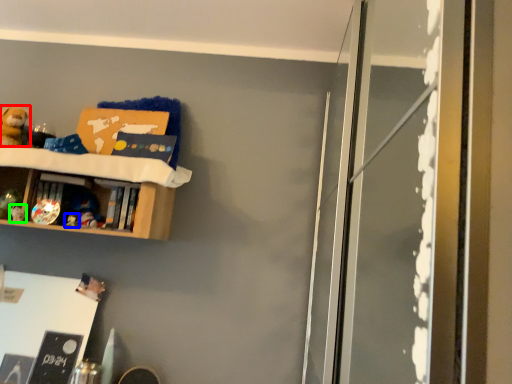
Question: Which object is the farthest from toy (highlighted by a red box)? Choose among these: toy (highlighted by a blue box) or toy (highlighted by a green box).

Choices:
 (A) toy
 (B) toy

Answer: (A)